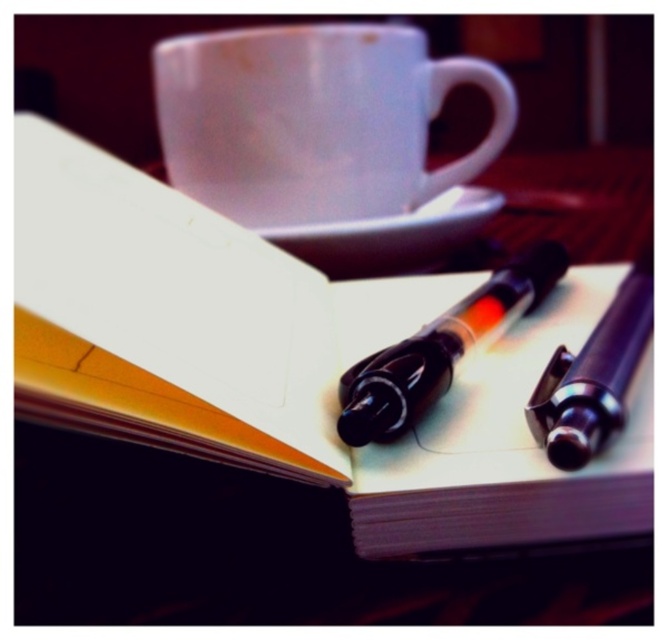
Is matte black pen at center positioned before white ceramic saucer at center?

That is True.

Locate an element on the screen. matte black pen at center is located at coordinates (440, 348).

Consider the image. Is matte black pen at center wider than black plastic pencil at center?

Correct, the width of matte black pen at center exceeds that of black plastic pencil at center.

Which is more to the right, matte black pen at center or black plastic pencil at center?

Positioned to the right is black plastic pencil at center.

What do you see at coordinates (440, 348) in the screenshot? The width and height of the screenshot is (668, 640). I see `matte black pen at center` at bounding box center [440, 348].

The height and width of the screenshot is (640, 668). I want to click on matte black pen at center, so click(x=440, y=348).

Can you confirm if yellow matte notebook at center is positioned to the left of matte black pen at center?

Indeed, yellow matte notebook at center is positioned on the left side of matte black pen at center.

Where is `yellow matte notebook at center`? yellow matte notebook at center is located at coordinates (295, 362).

Is point (341, 320) positioned in front of point (391, 365)?

No.

The height and width of the screenshot is (640, 668). I want to click on yellow matte notebook at center, so click(x=295, y=362).